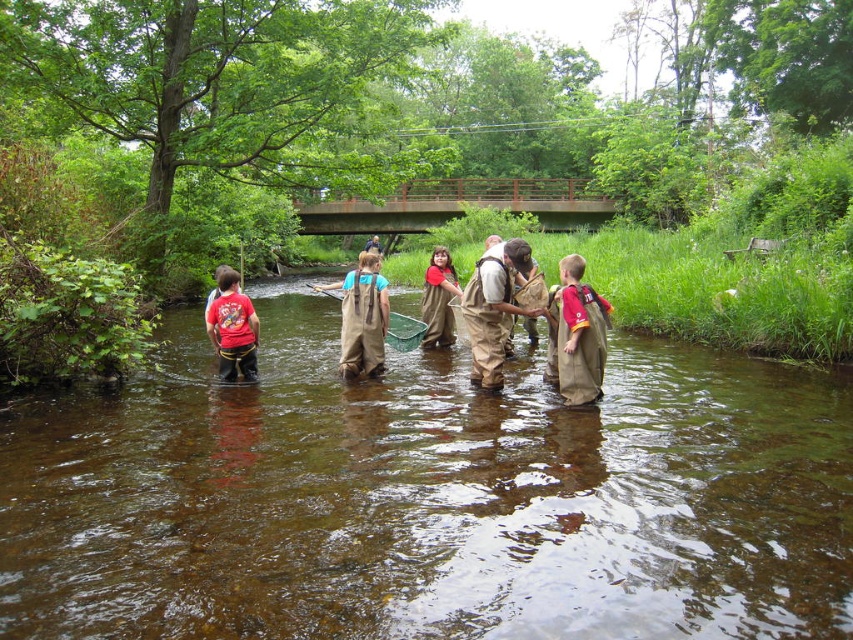
Question: Observing the image, what is the correct spatial positioning of matte red t-shirt at left in reference to matte brown waders at center?

Choices:
 (A) right
 (B) left

Answer: (B)

Question: Based on their relative distances, which object is farther from the matte red t-shirt at left?

Choices:
 (A) brown waterproof boots at center
 (B) brown canvas waders at center

Answer: (A)

Question: Which point is closer to the camera?

Choices:
 (A) matte brown waders at center
 (B) brown waterproof vest at center
 (C) brown rubber boots at center
 (D) brown waterproof boots at center

Answer: (C)

Question: Which of the following is the farthest from the observer?

Choices:
 (A) brown waterproof boots at center
 (B) brown rubber boots at center

Answer: (A)

Question: Does matte red t-shirt at left lie in front of matte brown waders at center?

Choices:
 (A) no
 (B) yes

Answer: (B)

Question: In this image, where is brown waterproof boots at center located relative to brown waterproof vest at center?

Choices:
 (A) right
 (B) left

Answer: (B)